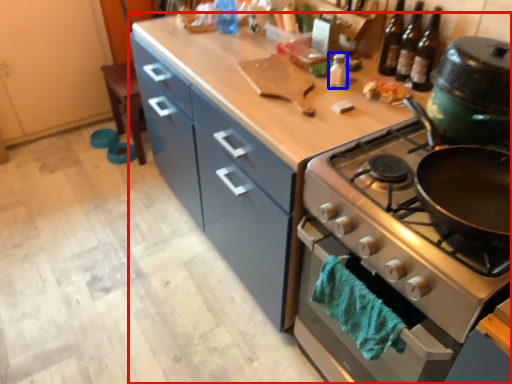
Question: Which of the following is the closest to the observer, countertop (highlighted by a red box) or bottle (highlighted by a blue box)?

Choices:
 (A) countertop
 (B) bottle

Answer: (A)